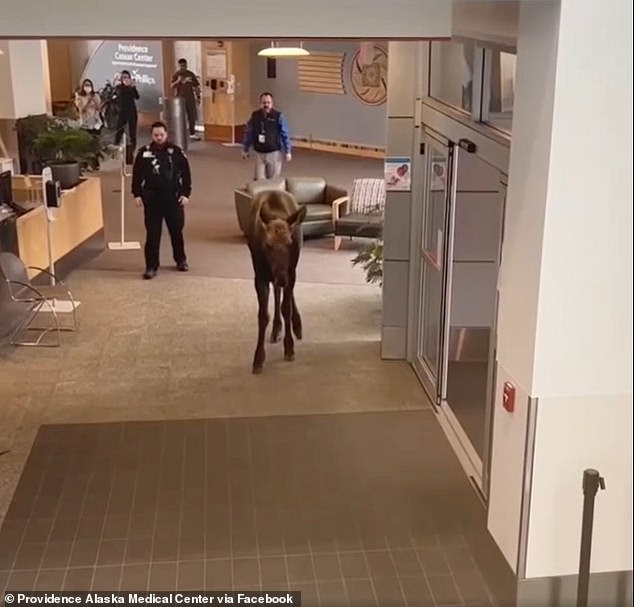
This screenshot has height=607, width=634. Find the location of `chair`. chair is located at coordinates (32, 299).